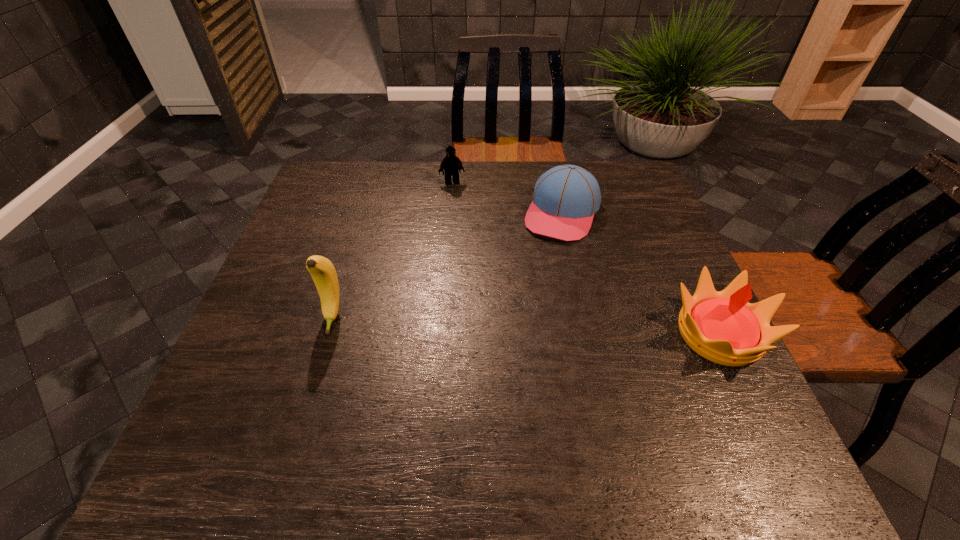
This screenshot has height=540, width=960. I want to click on vacant space located on the front-facing side of the second object from right to left, so click(546, 256).

What are the coordinates of `vacant space positioned on the face of the Lego` in the screenshot? It's located at (461, 206).

Find the location of a particular element. This screenshot has width=960, height=540. vacant area located on the face of the Lego is located at coordinates (463, 214).

At what (x,y) coordinates should I click in order to perform the action: click on free space located 0.300m on the face of the Lego. Please return your answer as a coordinate pair (x, y). Looking at the image, I should click on (472, 249).

The width and height of the screenshot is (960, 540). Find the location of `baseball cap that is at the far edge`. baseball cap that is at the far edge is located at coordinates (565, 198).

The width and height of the screenshot is (960, 540). What are the coordinates of `Lego present at the far edge` in the screenshot? It's located at (451, 164).

You are a GUI agent. You are given a task and a screenshot of the screen. Output one action in this format:
    pyautogui.click(x=<x>, y=<y>)
    Task: Click on the object positioned at the left edge
    The image size is (960, 540).
    Given the screenshot: What is the action you would take?
    pyautogui.click(x=323, y=273)

Where is `object that is at the right edge`? object that is at the right edge is located at coordinates (723, 327).

Identify the location of free space at the far edge of the desktop. (421, 173).

Where is `vacant area at the near edge of the desktop`? Image resolution: width=960 pixels, height=540 pixels. vacant area at the near edge of the desktop is located at coordinates [587, 415].